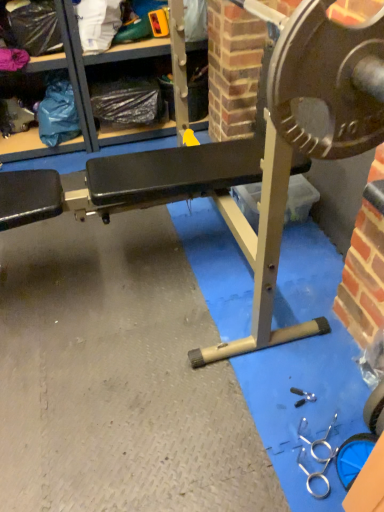
Question: Considering the relative positions of metallic gray shelf at upper center and metallic black bench at center in the image provided, is metallic gray shelf at upper center to the left of metallic black bench at center from the viewer's perspective?

Choices:
 (A) yes
 (B) no

Answer: (A)

Question: From a real-world perspective, is metallic gray shelf at upper center over metallic black bench at center?

Choices:
 (A) yes
 (B) no

Answer: (B)

Question: Is metallic gray shelf at upper center smaller than metallic black bench at center?

Choices:
 (A) no
 (B) yes

Answer: (A)

Question: Does metallic gray shelf at upper center come in front of metallic black bench at center?

Choices:
 (A) yes
 (B) no

Answer: (B)

Question: Is metallic black bench at center inside metallic gray shelf at upper center?

Choices:
 (A) no
 (B) yes

Answer: (A)

Question: From the image's perspective, is metallic gray shelf at upper center under metallic black bench at center?

Choices:
 (A) yes
 (B) no

Answer: (B)

Question: Is metallic black bench at center at the right side of metallic gray shelf at upper center?

Choices:
 (A) yes
 (B) no

Answer: (A)

Question: From a real-world perspective, is metallic black bench at center located higher than metallic gray shelf at upper center?

Choices:
 (A) yes
 (B) no

Answer: (A)

Question: Is metallic gray shelf at upper center at the back of metallic black bench at center?

Choices:
 (A) no
 (B) yes

Answer: (A)

Question: From a real-world perspective, is metallic black bench at center beneath metallic gray shelf at upper center?

Choices:
 (A) no
 (B) yes

Answer: (A)

Question: Is metallic black bench at center surrounding metallic gray shelf at upper center?

Choices:
 (A) yes
 (B) no

Answer: (B)

Question: Considering the relative sizes of metallic black bench at center and metallic gray shelf at upper center in the image provided, is metallic black bench at center bigger than metallic gray shelf at upper center?

Choices:
 (A) yes
 (B) no

Answer: (B)

Question: Is metallic black bench at center inside or outside of metallic gray shelf at upper center?

Choices:
 (A) inside
 (B) outside

Answer: (B)